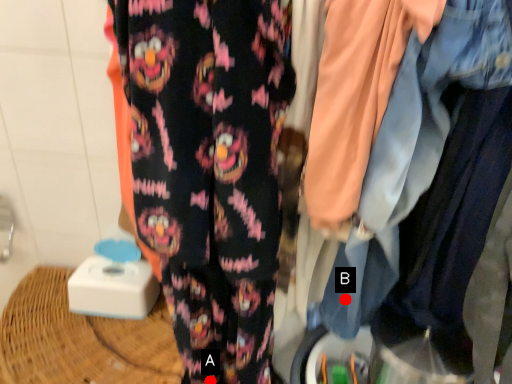
Question: Two points are circled on the image, labeled by A and B beside each circle. Which point is closer to the camera?

Choices:
 (A) A is closer
 (B) B is closer

Answer: (B)